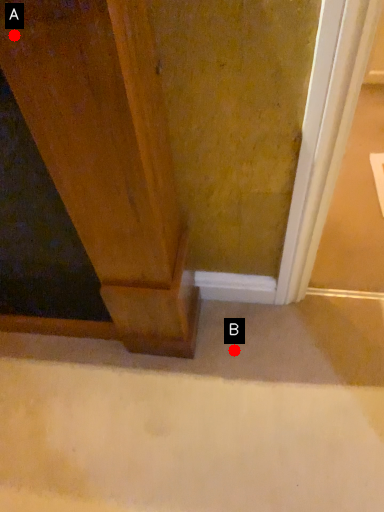
Question: Two points are circled on the image, labeled by A and B beside each circle. Which point appears farthest from the camera in this image?

Choices:
 (A) A is further
 (B) B is further

Answer: (B)